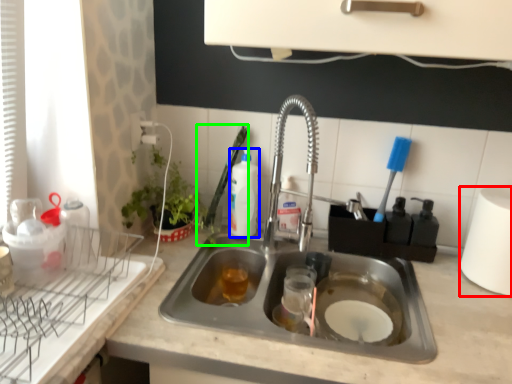
Question: Considering the real-world distances, which object is farthest from paper towel (highlighted by a red box)? beverage (highlighted by a blue box) or brush (highlighted by a green box)?

Choices:
 (A) beverage
 (B) brush

Answer: (B)